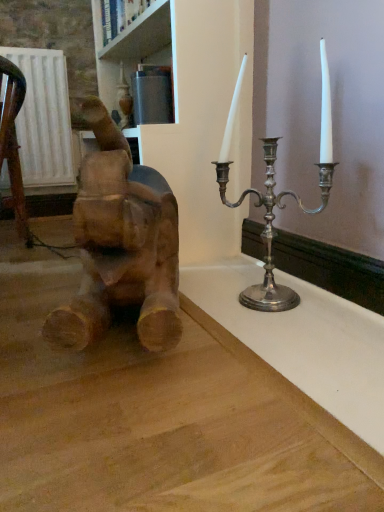
You are a GUI agent. You are given a task and a screenshot of the screen. Output one action in this format:
    pyautogui.click(x=<x>, y=<y>)
    Task: Click on the vacant area located to the right-hand side of wooden elephant at left
    
    Given the screenshot: What is the action you would take?
    pyautogui.click(x=259, y=330)